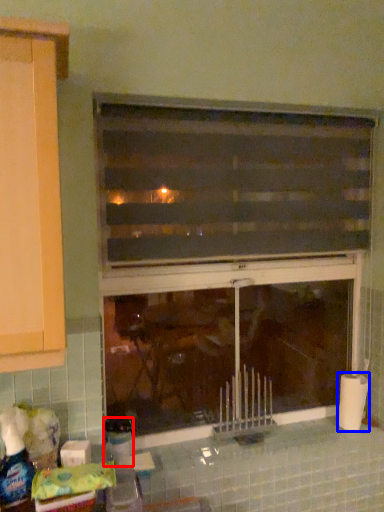
Question: Which object is further to the camera taking this photo, bottle (highlighted by a red box) or toilet paper (highlighted by a blue box)?

Choices:
 (A) bottle
 (B) toilet paper

Answer: (B)